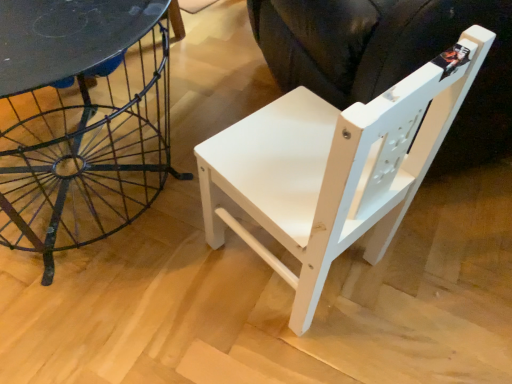
At what (x,y) coordinates should I click in order to perform the action: click on free spot below metallic black table at left (from a real-world perspective). Please return your answer as a coordinate pair (x, y). Image resolution: width=512 pixels, height=384 pixels. Looking at the image, I should click on (106, 188).